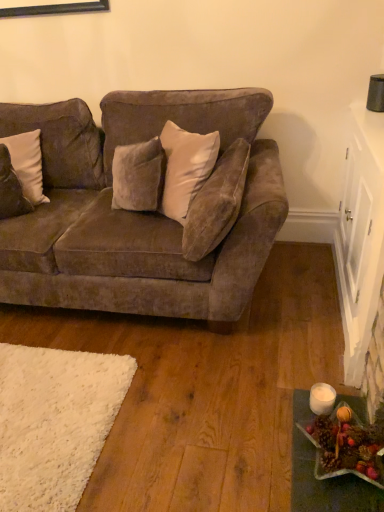
Question: Considering the relative sizes of shiny metallic star at lower right and velvet beige pillow at center, the 1th pillow in the right-to-left sequence, in the image provided, is shiny metallic star at lower right wider than velvet beige pillow at center, the 1th pillow in the right-to-left sequence,?

Choices:
 (A) yes
 (B) no

Answer: (A)

Question: Is shiny metallic star at lower right not inside velvet beige pillow at center, which is the second pillow from left to right?

Choices:
 (A) yes
 (B) no

Answer: (A)

Question: Are shiny metallic star at lower right and velvet beige pillow at center, the 1th pillow in the right-to-left sequence, beside each other?

Choices:
 (A) yes
 (B) no

Answer: (B)

Question: Does shiny metallic star at lower right appear on the right side of velvet beige pillow at center, the 1th pillow in the right-to-left sequence?

Choices:
 (A) no
 (B) yes

Answer: (B)

Question: Considering the relative sizes of shiny metallic star at lower right and velvet beige pillow at center, the 1th pillow in the right-to-left sequence, in the image provided, is shiny metallic star at lower right taller than velvet beige pillow at center, the 1th pillow in the right-to-left sequence,?

Choices:
 (A) no
 (B) yes

Answer: (A)

Question: Based on their sizes in the image, would you say velvet beige pillow at center, the 1th pillow in the right-to-left sequence, is bigger or smaller than white velvet pillow at left, the second pillow positioned from the right?

Choices:
 (A) small
 (B) big

Answer: (B)

Question: Is velvet beige pillow at center, which is the second pillow from left to right, wider or thinner than white velvet pillow at left, acting as the first pillow starting from the left?

Choices:
 (A) wide
 (B) thin

Answer: (A)

Question: Is point (201, 243) positioned closer to the camera than point (31, 136)?

Choices:
 (A) farther
 (B) closer

Answer: (B)

Question: Is velvet beige pillow at center, the 1th pillow in the right-to-left sequence, to the left or to the right of white velvet pillow at left, acting as the first pillow starting from the left, in the image?

Choices:
 (A) right
 (B) left

Answer: (A)

Question: From a real-world perspective, is velvet brown couch at left positioned above or below velvet beige pillow at center, the 1th pillow in the right-to-left sequence?

Choices:
 (A) below
 (B) above

Answer: (A)

Question: Is velvet brown couch at left wider or thinner than velvet beige pillow at center, which is the second pillow from left to right?

Choices:
 (A) wide
 (B) thin

Answer: (A)

Question: Is velvet brown couch at left taller or shorter than velvet beige pillow at center, which is the second pillow from left to right?

Choices:
 (A) short
 (B) tall

Answer: (B)

Question: Considering the positions of velvet brown couch at left and velvet beige pillow at center, the 1th pillow in the right-to-left sequence, in the image, is velvet brown couch at left bigger or smaller than velvet beige pillow at center, the 1th pillow in the right-to-left sequence,?

Choices:
 (A) big
 (B) small

Answer: (A)

Question: From a real-world perspective, is white velvet pillow at left, the second pillow positioned from the right, positioned above or below velvet beige pillow at center, which is the second pillow from left to right?

Choices:
 (A) below
 (B) above

Answer: (B)

Question: Choose the correct answer: Is white velvet pillow at left, the second pillow positioned from the right, inside velvet beige pillow at center, which is the second pillow from left to right, or outside it?

Choices:
 (A) outside
 (B) inside

Answer: (A)